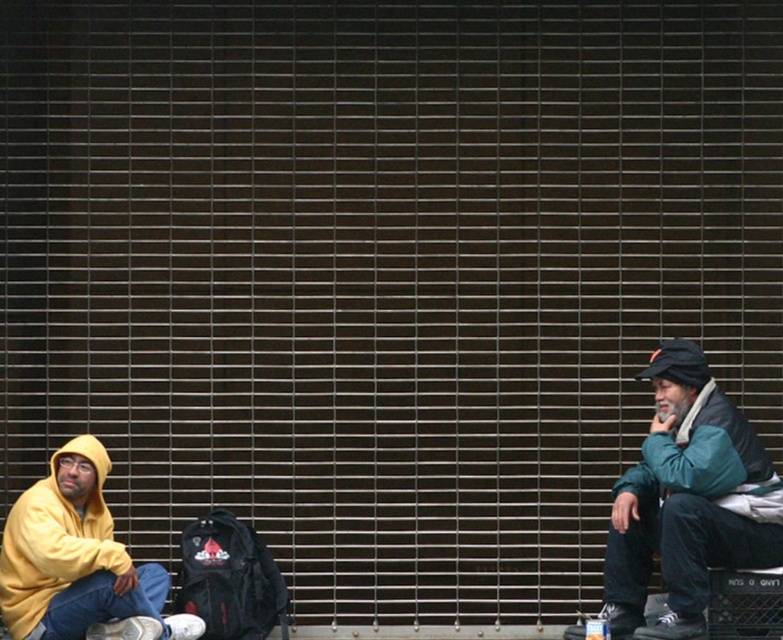
You are a delivery robot with a 1.2 meter wide package. You need to pass between the teal fleece jacket at right and the matte yellow hoodie at lower left to reach the delivery point behind them. Can you fit through the space between them?

The distance between the teal fleece jacket at right and the matte yellow hoodie at lower left is 1.56 meters. Since your package is 1.2 meters wide, you can fit through the space between them as the gap is wider than the package.

You are taking a photo of the two points in the image. Which point, point [677,621] or point [96,518], will appear larger in your photo?

Point [677,621] is closer to the camera than point [96,518], so it will appear larger in the photo.